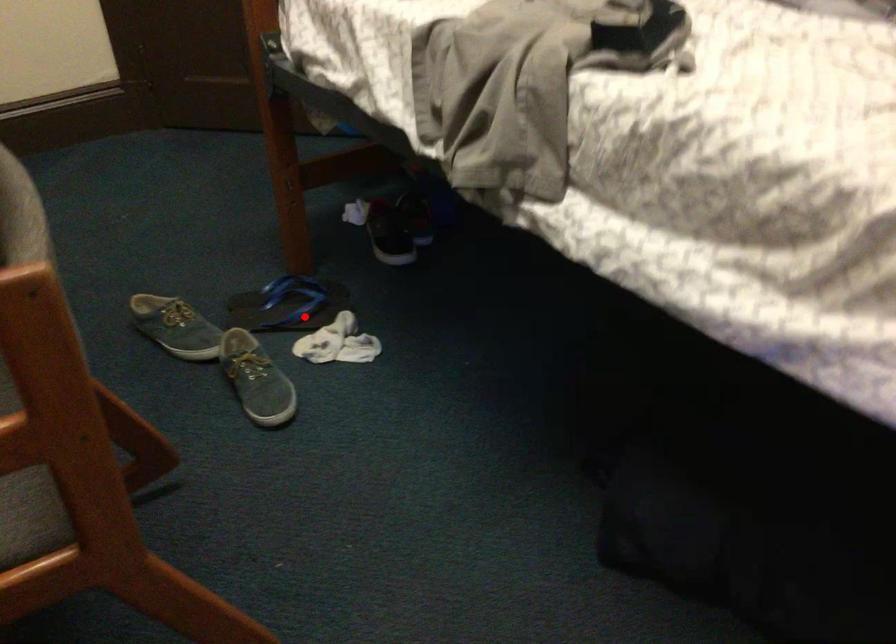
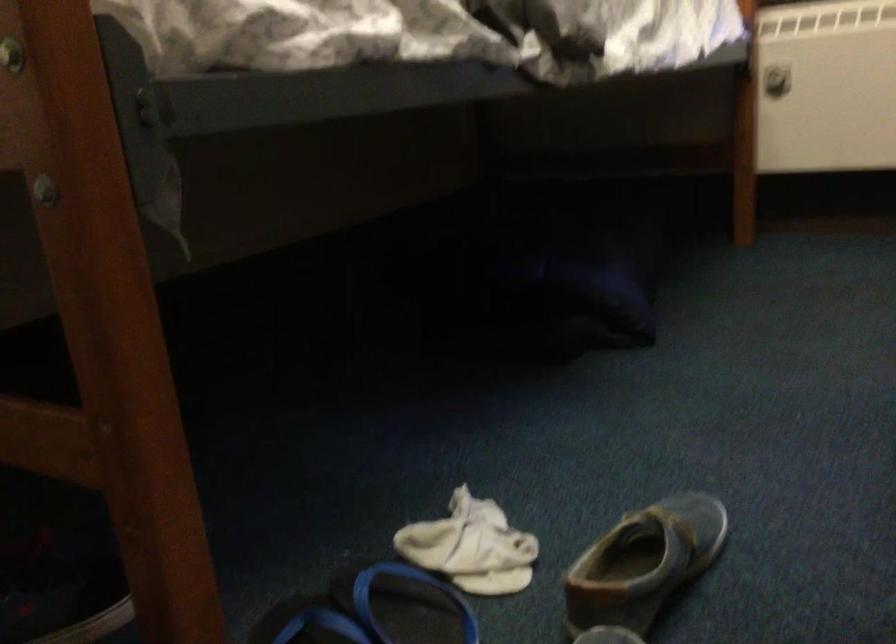
Question: I am providing you with two images of the same scene from different viewpoints. In image1, a red point is highlighted. Considering the same 3D point in image2, which of the following is correct?

Choices:
 (A) It is closer
 (B) It is farther

Answer: (A)